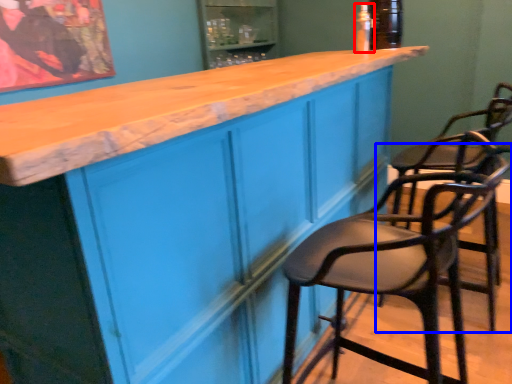
Question: Among these objects, which one is nearest to the camera, bottle (highlighted by a red box) or chair (highlighted by a blue box)?

Choices:
 (A) bottle
 (B) chair

Answer: (B)